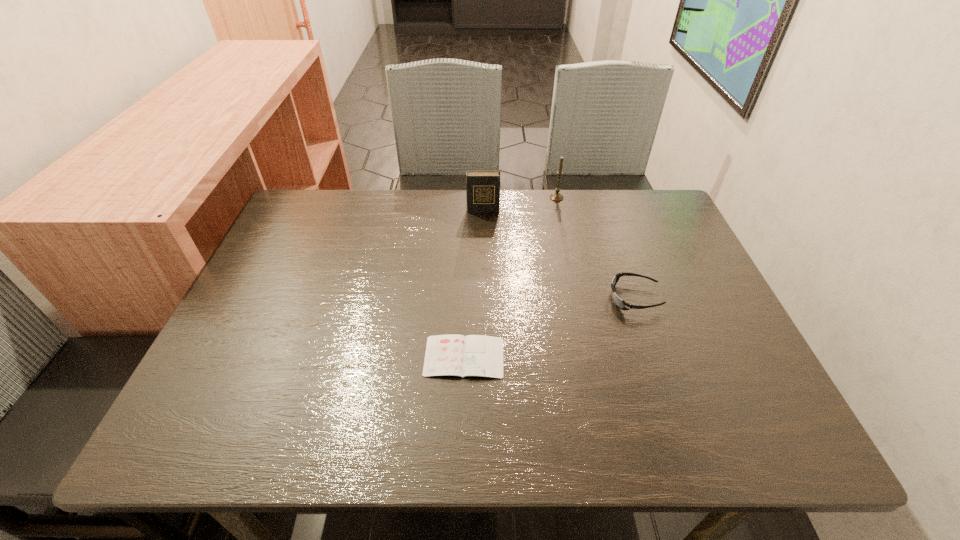
Find the location of `candle`. candle is located at coordinates (557, 196).

You are a GUI agent. You are given a task and a screenshot of the screen. Output one action in this format:
    pyautogui.click(x=<x>, y=<y>)
    Task: Click on the third object from left to right
    This screenshot has height=540, width=960.
    Given the screenshot: What is the action you would take?
    pyautogui.click(x=557, y=196)

Image resolution: width=960 pixels, height=540 pixels. Identify the location of the taller diary. (482, 187).

You are a GUI agent. You are given a task and a screenshot of the screen. Output one action in this format:
    pyautogui.click(x=<x>, y=<y>)
    Task: Click on the second farthest object
    
    Given the screenshot: What is the action you would take?
    pyautogui.click(x=482, y=187)

Locate an element on the screen. Image resolution: width=960 pixels, height=540 pixels. sunglasses is located at coordinates (621, 304).

Identify the location of the second shortest object. Image resolution: width=960 pixels, height=540 pixels. (621, 304).

Identify the location of the shortest object. This screenshot has width=960, height=540. (446, 355).

This screenshot has height=540, width=960. Find the location of `the nearer diary`. the nearer diary is located at coordinates (446, 355).

This screenshot has width=960, height=540. I want to click on vacant region located 0.310m on the right of the candle, so click(x=665, y=198).

You are a GUI agent. You are given a task and a screenshot of the screen. Output one action in this format:
    pyautogui.click(x=<x>, y=<y>)
    Task: Click on the vacant space located 0.070m on the front cover of the farther diary
    The height and width of the screenshot is (540, 960).
    Given the screenshot: What is the action you would take?
    pyautogui.click(x=483, y=228)